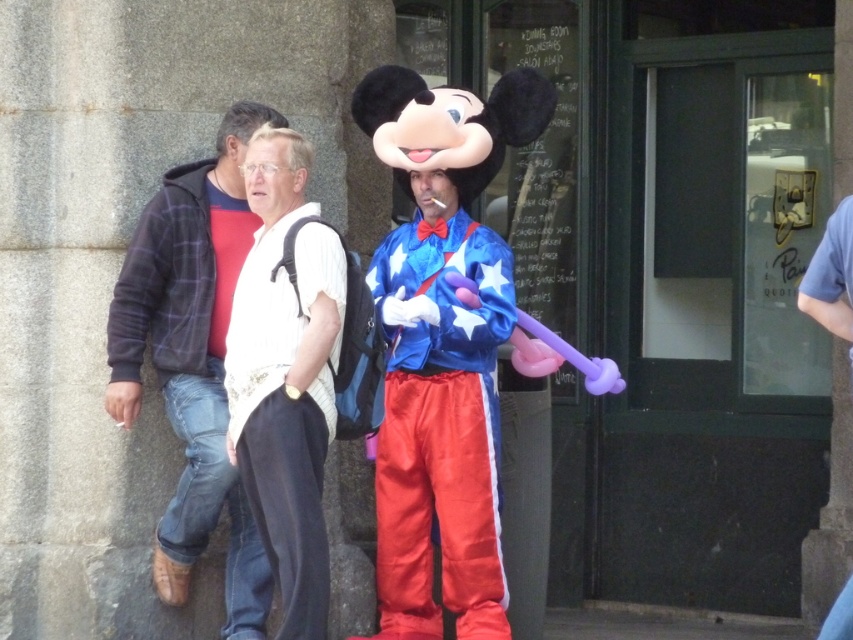
Question: Which point appears closest to the camera in this image?

Choices:
 (A) (213, 513)
 (B) (424, 241)

Answer: (A)

Question: Which object appears farthest from the camera in this image?

Choices:
 (A) white knit sweater at center
 (B) velvet blue costume at center
 (C) white knitwear at center
 (D) shiny blue fabric at center

Answer: (B)

Question: Does white knit sweater at center have a larger size compared to white knitwear at center?

Choices:
 (A) yes
 (B) no

Answer: (A)

Question: Can you confirm if shiny blue fabric at center is bigger than white knitwear at center?

Choices:
 (A) no
 (B) yes

Answer: (B)

Question: Among these points, which one is farthest from the camera?

Choices:
 (A) (494, 588)
 (B) (251, 371)
 (C) (252, 563)

Answer: (C)

Question: Can you confirm if white knit sweater at center is positioned to the left of white knitwear at center?

Choices:
 (A) no
 (B) yes

Answer: (B)